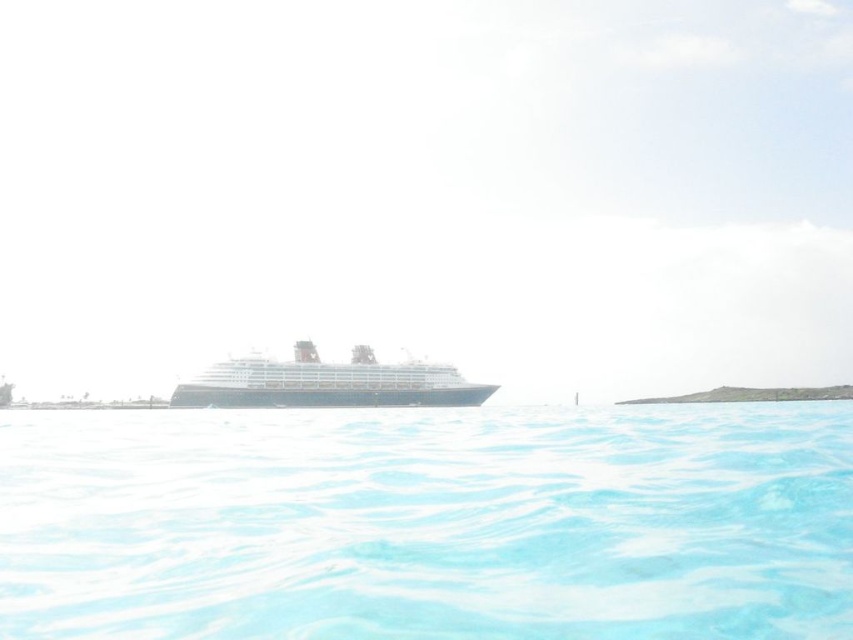
Does point (630, 573) lie in front of point (345, 404)?

Yes, point (630, 573) is closer to viewer.

Looking at this image, is clear blue water at lower center thinner than black glossy cruise ship at center?

Incorrect, clear blue water at lower center's width is not less than black glossy cruise ship at center's.

Describe the element at coordinates (428, 524) in the screenshot. The height and width of the screenshot is (640, 853). I see `clear blue water at lower center` at that location.

Find the location of `clear blue water at lower center`. clear blue water at lower center is located at coordinates (428, 524).